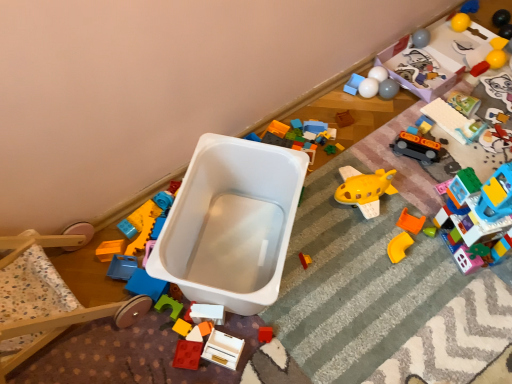
The height and width of the screenshot is (384, 512). Identify the location of vacant space behind wooden toy box at center, arranged as the fourth toy when viewed from the left. (234, 281).